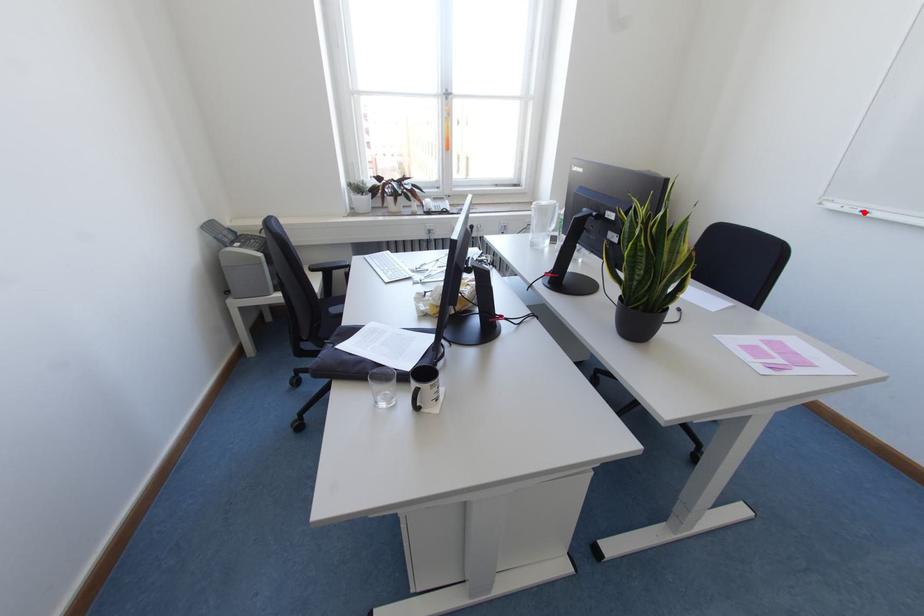
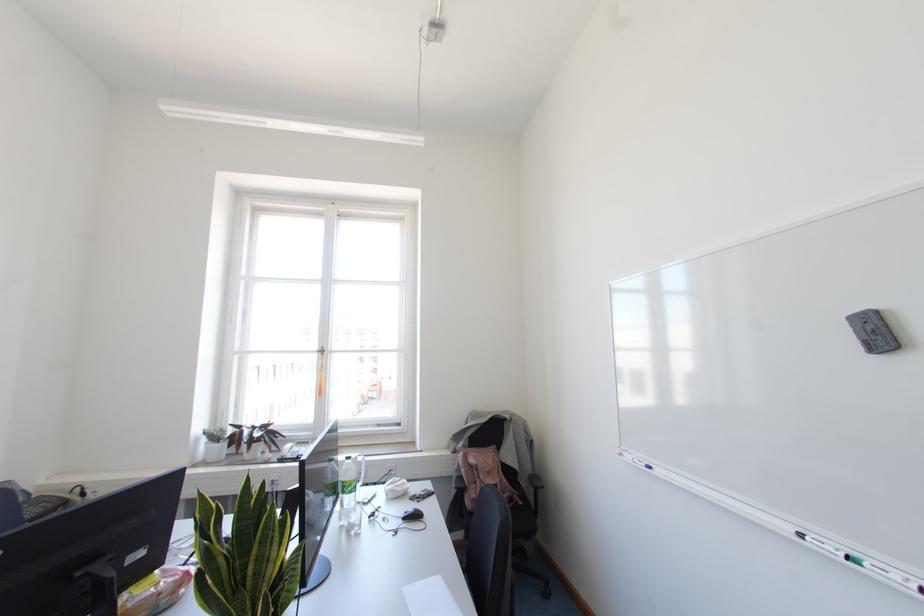
In the second image, find the point that corresponds to the highlighted location in the first image.

(649, 467)